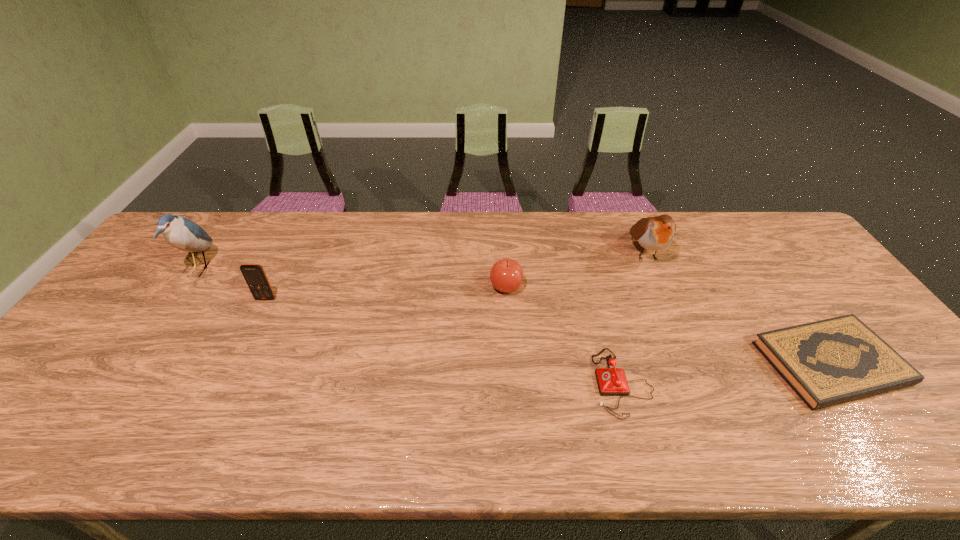
Identify the location of the leftmost object. Image resolution: width=960 pixels, height=540 pixels. click(x=181, y=233).

Where is `the second tallest object`? Image resolution: width=960 pixels, height=540 pixels. the second tallest object is located at coordinates click(x=655, y=233).

Locate an element on the screen. This screenshot has height=540, width=960. the second object from right to left is located at coordinates (655, 233).

Identify the location of the fifth object from right to left. (254, 274).

Find the location of a particular element. This screenshot has height=540, width=960. the fourth tallest object is located at coordinates (506, 275).

You are a GUI agent. You are given a task and a screenshot of the screen. Output one action in this format:
    pyautogui.click(x=<x>, y=<y>)
    Task: Click on the apple
    Image resolution: width=960 pixels, height=540 pixels.
    Given the screenshot: What is the action you would take?
    pyautogui.click(x=506, y=275)

Find the location of a particular element. telephone is located at coordinates (611, 381).

What are the coordinates of `the fifth tallest object` in the screenshot? It's located at (611, 381).

Locate an element on the screen. the rightmost object is located at coordinates (829, 362).

The image size is (960, 540). Find the location of `hardback book`. hardback book is located at coordinates (829, 362).